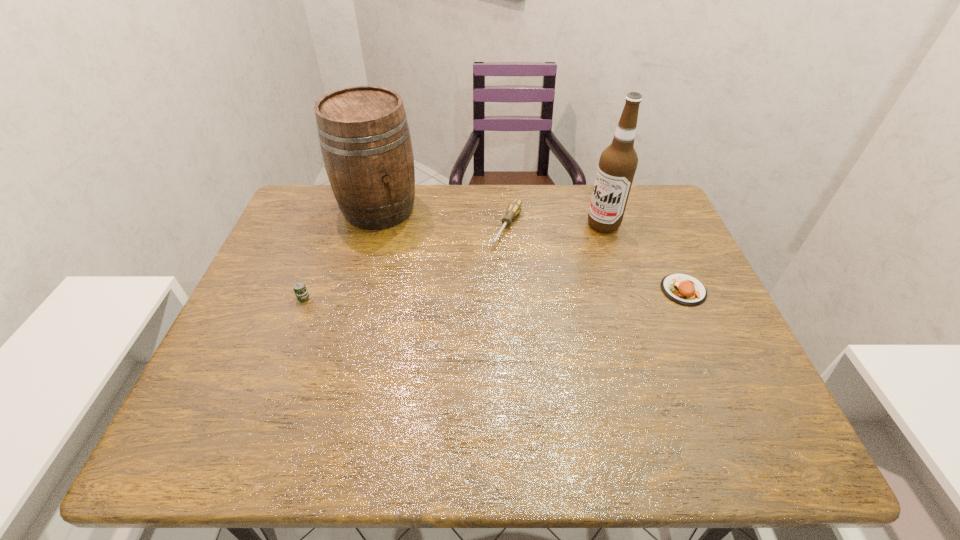
Where is `free location that satisfies the following two spatial constraints: 1. on the back side of the third shortest object; 2. on the left side of the cider`? Image resolution: width=960 pixels, height=540 pixels. free location that satisfies the following two spatial constraints: 1. on the back side of the third shortest object; 2. on the left side of the cider is located at coordinates (337, 209).

Locate an element on the screen. This screenshot has height=540, width=960. free location that satisfies the following two spatial constraints: 1. on the back side of the screwdriver; 2. on the left side of the alcohol is located at coordinates (508, 225).

Where is `free location that satisfies the following two spatial constraints: 1. on the back side of the alcohol; 2. on the left side of the third object from left to right`? This screenshot has width=960, height=540. free location that satisfies the following two spatial constraints: 1. on the back side of the alcohol; 2. on the left side of the third object from left to right is located at coordinates 508,225.

The width and height of the screenshot is (960, 540). I want to click on free point that satisfies the following two spatial constraints: 1. on the back side of the fourth object from left to right; 2. on the right side of the beer can, so click(x=331, y=225).

Identify the location of free space that satisfies the following two spatial constraints: 1. on the front side of the third object from right to left; 2. on the right side of the rightmost object. The image size is (960, 540). (512, 290).